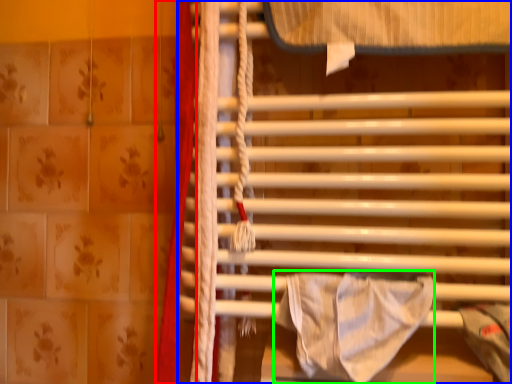
Question: Which object is positioned closest to curtain (highlighted by a red box)? Select from furniture (highlighted by a blue box) and blanket (highlighted by a green box).

Choices:
 (A) furniture
 (B) blanket

Answer: (A)